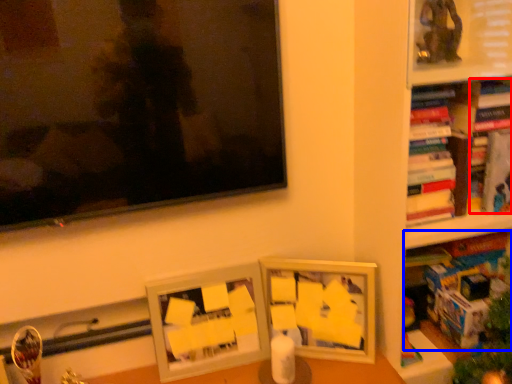
Question: Among these objects, which one is farthest to the camera, book (highlighted by a red box) or book (highlighted by a blue box)?

Choices:
 (A) book
 (B) book

Answer: (A)